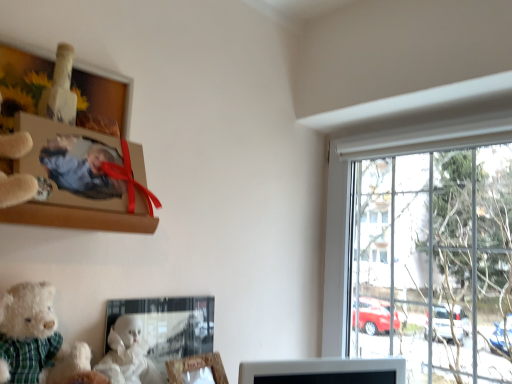
Question: From a real-world perspective, is matte glass picture frame at lower center, which ranks as the 2th picture frame in bottom-to-top order, positioned over white fluffy teddy bear at lower left based on gravity?

Choices:
 (A) yes
 (B) no

Answer: (B)

Question: Is matte glass picture frame at lower center, placed as the 3th picture frame when sorted from top to bottom, at the left side of white fluffy teddy bear at lower left?

Choices:
 (A) yes
 (B) no

Answer: (B)

Question: Could white fluffy teddy bear at lower left be considered to be inside matte glass picture frame at lower center, which ranks as the 2th picture frame in bottom-to-top order?

Choices:
 (A) no
 (B) yes

Answer: (A)

Question: Does matte glass picture frame at lower center, placed as the 3th picture frame when sorted from top to bottom, lie behind white fluffy teddy bear at lower left?

Choices:
 (A) yes
 (B) no

Answer: (A)

Question: Is matte glass picture frame at lower center, placed as the 3th picture frame when sorted from top to bottom, beside white fluffy teddy bear at lower left?

Choices:
 (A) yes
 (B) no

Answer: (B)

Question: Is matte glass picture frame at lower center, placed as the 3th picture frame when sorted from top to bottom, bigger than white fluffy teddy bear at lower left?

Choices:
 (A) no
 (B) yes

Answer: (A)

Question: Considering the relative sizes of matte glass picture frame at lower center, placed as the 3th picture frame when sorted from top to bottom, and matte cardboard photo frame at upper left, the 4th picture frame from the bottom, in the image provided, is matte glass picture frame at lower center, placed as the 3th picture frame when sorted from top to bottom, taller than matte cardboard photo frame at upper left, the 4th picture frame from the bottom,?

Choices:
 (A) no
 (B) yes

Answer: (A)

Question: Would you say matte glass picture frame at lower center, which ranks as the 2th picture frame in bottom-to-top order, contains matte cardboard photo frame at upper left, positioned as the 1th picture frame in top-to-bottom order?

Choices:
 (A) yes
 (B) no

Answer: (B)

Question: Is matte glass picture frame at lower center, which ranks as the 2th picture frame in bottom-to-top order, shorter than matte cardboard photo frame at upper left, positioned as the 1th picture frame in top-to-bottom order?

Choices:
 (A) yes
 (B) no

Answer: (A)

Question: From the image's perspective, is matte glass picture frame at lower center, which ranks as the 2th picture frame in bottom-to-top order, beneath matte cardboard photo frame at upper left, positioned as the 1th picture frame in top-to-bottom order?

Choices:
 (A) yes
 (B) no

Answer: (A)

Question: Is matte glass picture frame at lower center, placed as the 3th picture frame when sorted from top to bottom, not close to matte cardboard photo frame at upper left, positioned as the 1th picture frame in top-to-bottom order?

Choices:
 (A) yes
 (B) no

Answer: (B)

Question: Is matte glass picture frame at lower center, which ranks as the 2th picture frame in bottom-to-top order, outside of matte cardboard photo frame at upper left, positioned as the 1th picture frame in top-to-bottom order?

Choices:
 (A) no
 (B) yes

Answer: (B)

Question: Is white fluffy teddy bear at lower left at the back of wooden picture frame at lower center, which is the 4th picture frame in top-to-bottom order?

Choices:
 (A) no
 (B) yes

Answer: (A)